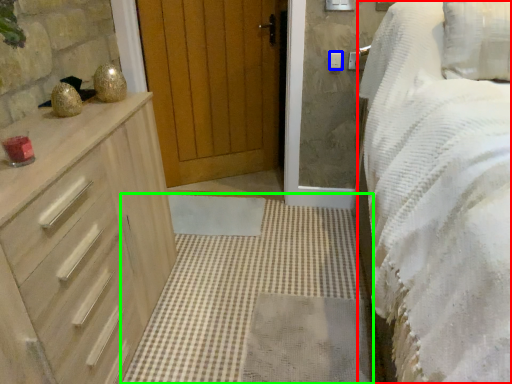
Question: Which is farther away from bed (highlighted by a red box)? light switch (highlighted by a blue box) or plain (highlighted by a green box)?

Choices:
 (A) light switch
 (B) plain

Answer: (A)